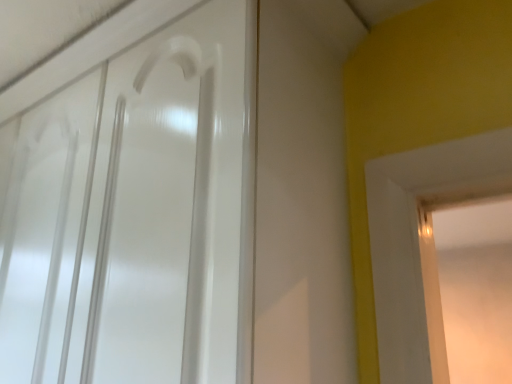
Question: Should I look upward or downward to see white glossy door handle at upper left?

Choices:
 (A) up
 (B) down

Answer: (B)